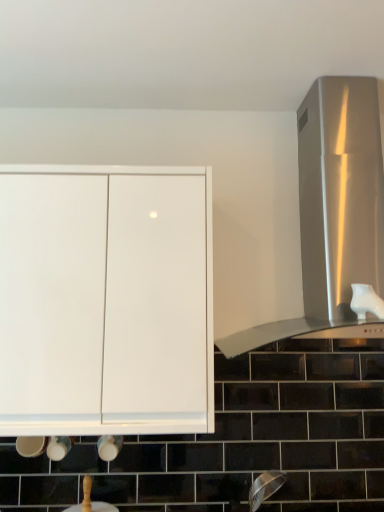
Question: Does white glossy sink at lower center turn towards white glossy cabinet at upper left?

Choices:
 (A) no
 (B) yes

Answer: (A)

Question: Is white glossy sink at lower center completely or partially outside of white glossy cabinet at upper left?

Choices:
 (A) no
 (B) yes

Answer: (B)

Question: Can you confirm if white glossy sink at lower center is wider than white glossy cabinet at upper left?

Choices:
 (A) no
 (B) yes

Answer: (A)

Question: Is white glossy sink at lower center positioned with its back to white glossy cabinet at upper left?

Choices:
 (A) no
 (B) yes

Answer: (A)

Question: Is white glossy sink at lower center to the right of white glossy cabinet at upper left from the viewer's perspective?

Choices:
 (A) yes
 (B) no

Answer: (A)

Question: From a real-world perspective, is white glossy cabinet at upper left physically located above or below white glossy sink at lower center?

Choices:
 (A) above
 (B) below

Answer: (A)

Question: Considering their positions, is white glossy cabinet at upper left located in front of or behind white glossy sink at lower center?

Choices:
 (A) behind
 (B) front

Answer: (B)

Question: From the image's perspective, relative to white glossy sink at lower center, is white glossy cabinet at upper left above or below?

Choices:
 (A) above
 (B) below

Answer: (A)

Question: Looking at the image, does white glossy cabinet at upper left seem bigger or smaller compared to white glossy sink at lower center?

Choices:
 (A) small
 (B) big

Answer: (B)

Question: Is white glossy cabinet at upper left taller or shorter than stainless steel vent at right?

Choices:
 (A) short
 (B) tall

Answer: (A)

Question: Considering their positions, is white glossy cabinet at upper left located in front of or behind stainless steel vent at right?

Choices:
 (A) front
 (B) behind

Answer: (A)

Question: In terms of size, does white glossy cabinet at upper left appear bigger or smaller than stainless steel vent at right?

Choices:
 (A) big
 (B) small

Answer: (B)

Question: Based on their positions, is white glossy cabinet at upper left located to the left or right of stainless steel vent at right?

Choices:
 (A) right
 (B) left

Answer: (B)

Question: Is white glossy sink at lower center inside or outside of stainless steel vent at right?

Choices:
 (A) inside
 (B) outside

Answer: (B)

Question: Is white glossy sink at lower center taller or shorter than stainless steel vent at right?

Choices:
 (A) tall
 (B) short

Answer: (B)